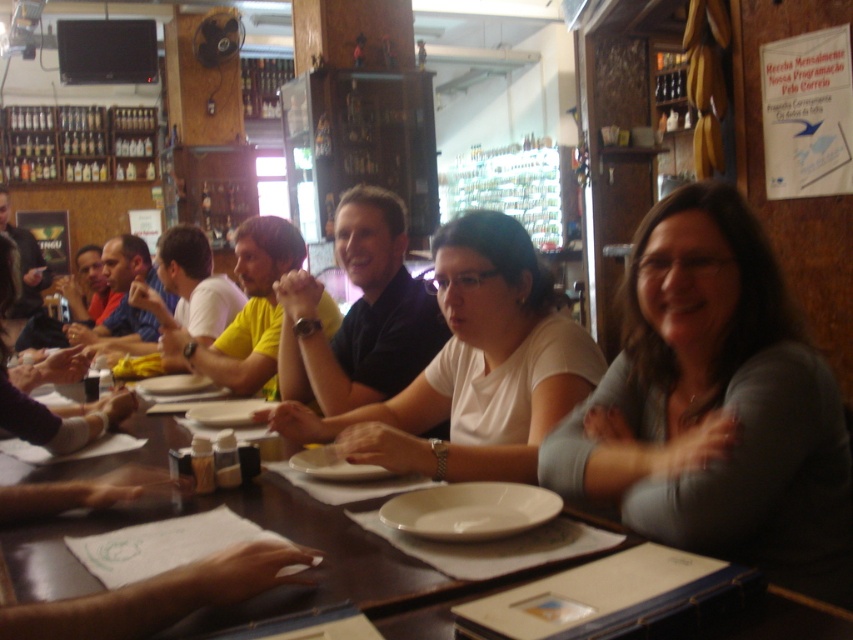
Who is taller, gray matte shirt at center or wooden table at center?

gray matte shirt at center is taller.

Can you confirm if gray matte shirt at center is positioned to the left of wooden table at center?

Incorrect, gray matte shirt at center is not on the left side of wooden table at center.

You are a GUI agent. You are given a task and a screenshot of the screen. Output one action in this format:
    pyautogui.click(x=<x>, y=<y>)
    Task: Click on the gray matte shirt at center
    Image resolution: width=853 pixels, height=640 pixels.
    Given the screenshot: What is the action you would take?
    pyautogui.click(x=715, y=404)

The width and height of the screenshot is (853, 640). Identify the location of white matte shirt at center. (473, 369).

Can you confirm if white matte shirt at center is positioned to the left of wooden table at center?

In fact, white matte shirt at center is to the right of wooden table at center.

The image size is (853, 640). I want to click on white matte shirt at center, so click(473, 369).

Is gray matte shirt at center closer to the viewer compared to white matte shirt at center?

That is True.

Which is behind, point (727, 220) or point (554, 349)?

Point (554, 349)

Locate an element on the screen. Image resolution: width=853 pixels, height=640 pixels. gray matte shirt at center is located at coordinates (715, 404).